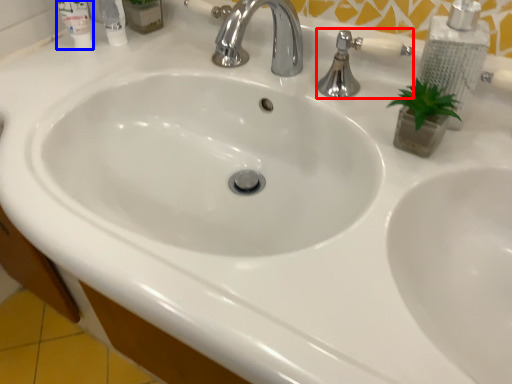
Question: Which object appears farthest to the camera in this image, plumbing fixture (highlighted by a red box) or mouthwash (highlighted by a blue box)?

Choices:
 (A) plumbing fixture
 (B) mouthwash

Answer: (B)